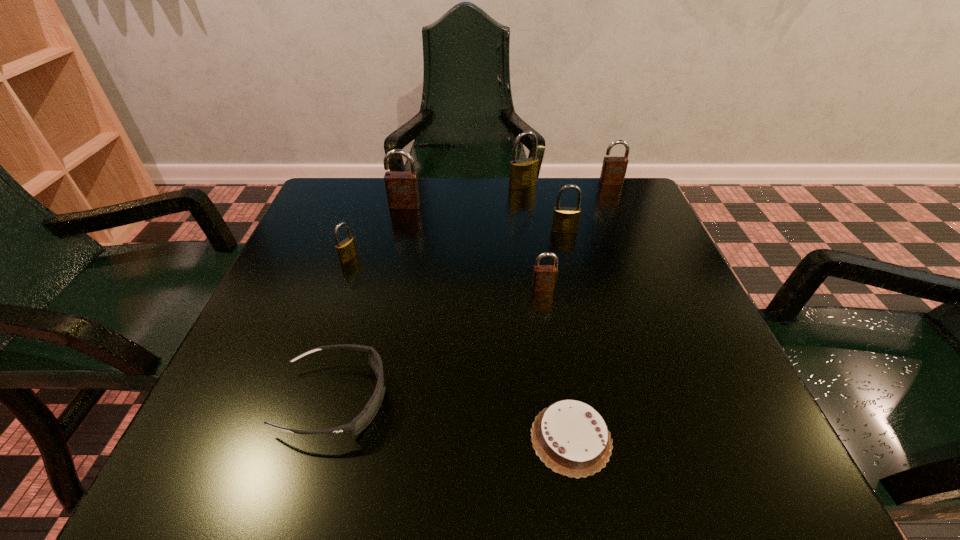
The image size is (960, 540). Identify the location of free space that is in between the second brass padlock from right to left and the second biggest brown padlock. (566, 184).

Find the location of a particular element. blank region between the second brass padlock from left to right and the shortest object is located at coordinates (547, 312).

What are the coordinates of `vacant area between the second brass padlock from left to right and the second farthest brass padlock` in the screenshot? It's located at (543, 208).

Locate an element on the screen. unoccupied area between the shortest object and the third nearest padlock is located at coordinates (567, 334).

Image resolution: width=960 pixels, height=540 pixels. In order to click on free space between the biggest brown padlock and the farthest brown padlock in this screenshot , I will do `click(508, 194)`.

In order to click on unoccupied position between the second padlock from right to left and the rightmost padlock in this screenshot , I will do `click(588, 206)`.

Select which object appears as the sixth closest to the chocolate cake. Please provide its 2D coordinates. Your answer should be formatted as a tuple, i.e. [(x, y)], where the tuple contains the x and y coordinates of a point satisfying the conditions above.

[(523, 173)]

This screenshot has width=960, height=540. What are the coordinates of `object identified as the fourth closest to the goggles` in the screenshot? It's located at (402, 190).

I want to click on padlock that is the second nearest to the goggles, so click(x=544, y=276).

At what (x,y) coordinates should I click in order to perform the action: click on padlock that can be found as the closest to the third nearest object. Please return your answer as a coordinate pair (x, y). The image size is (960, 540). Looking at the image, I should click on (565, 219).